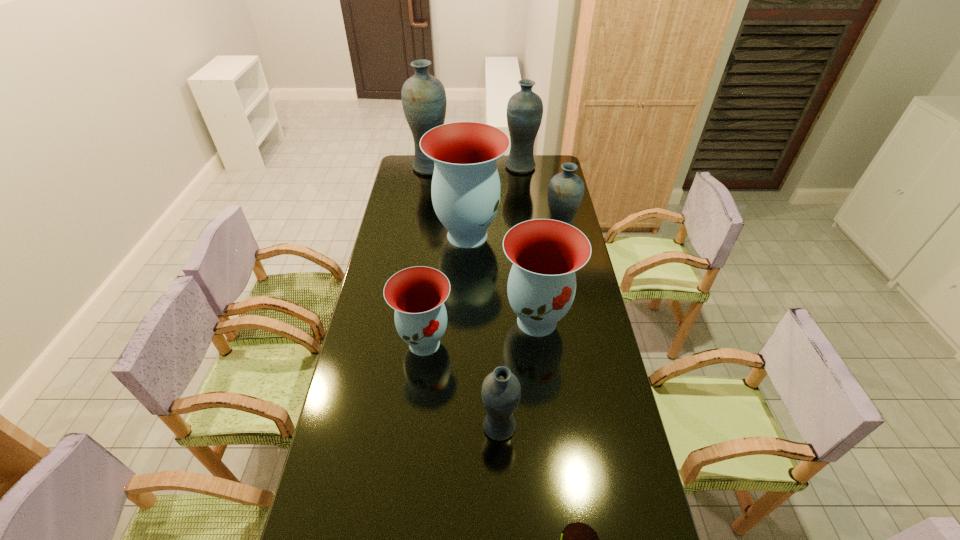
You are a GUI agent. You are given a task and a screenshot of the screen. Output one action in this format:
    pyautogui.click(x=<x>, y=<y>)
    Task: Click on the free space between the second biggest red vase and the smallest red vase
    The width and height of the screenshot is (960, 540).
    Given the screenshot: What is the action you would take?
    pyautogui.click(x=481, y=332)

This screenshot has height=540, width=960. Find the location of `vacant area between the smallest red vase and the second nearest blue vase`. vacant area between the smallest red vase and the second nearest blue vase is located at coordinates (492, 291).

Where is `free area in between the leftmost blue vase and the smallest red vase`? This screenshot has width=960, height=540. free area in between the leftmost blue vase and the smallest red vase is located at coordinates (427, 255).

Locate an element on the screen. This screenshot has height=540, width=960. the sixth closest object to the third biggest blue vase is located at coordinates pyautogui.click(x=501, y=391).

Point out which object is positioned as the nearest to the second smallest red vase. Please provide its 2D coordinates. Your answer should be formatted as a tuple, i.e. [(x, y)], where the tuple contains the x and y coordinates of a point satisfying the conditions above.

[(417, 294)]

Where is `vase that is the second closest one to the smallest red vase`? vase that is the second closest one to the smallest red vase is located at coordinates (501, 391).

Where is `vase that is the second closest to the biggest red vase`? The image size is (960, 540). vase that is the second closest to the biggest red vase is located at coordinates (545, 253).

Locate which blue vase ranks in proximity to the biggest blue vase. Please provide its 2D coordinates. Your answer should be formatted as a tuple, i.e. [(x, y)], where the tuple contains the x and y coordinates of a point satisfying the conditions above.

[(524, 112)]

Where is `blue vase object that ranks as the closest to the second nearest blue vase`? The width and height of the screenshot is (960, 540). blue vase object that ranks as the closest to the second nearest blue vase is located at coordinates (524, 112).

Select which red vase is the third closest to the shortest object. Please provide its 2D coordinates. Your answer should be formatted as a tuple, i.e. [(x, y)], where the tuple contains the x and y coordinates of a point satisfying the conditions above.

[(466, 192)]